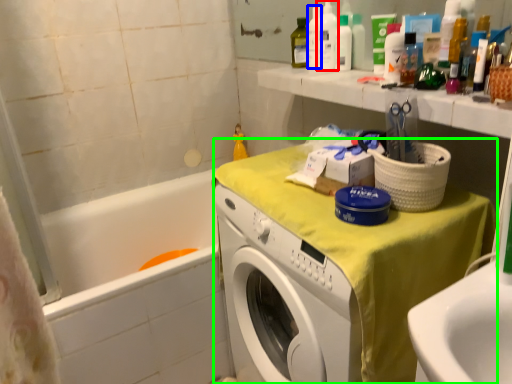
Question: Considering the real-world distances, which object is closest to cleaning product (highlighted by a red box)? bottle (highlighted by a blue box) or counter (highlighted by a green box).

Choices:
 (A) bottle
 (B) counter

Answer: (A)